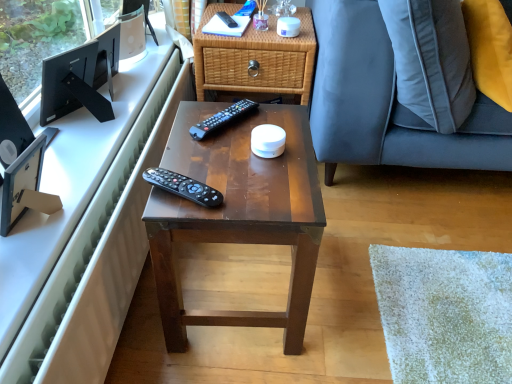
Where is `vacant space to the right of brown polished wood desk at center`? The height and width of the screenshot is (384, 512). vacant space to the right of brown polished wood desk at center is located at coordinates (369, 284).